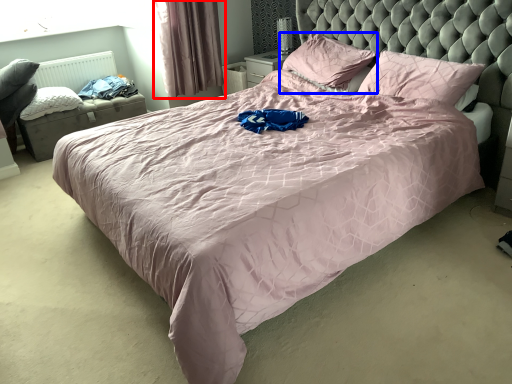
Question: Which object appears farthest to the camera in this image, curtain (highlighted by a red box) or pillow (highlighted by a blue box)?

Choices:
 (A) curtain
 (B) pillow

Answer: (A)